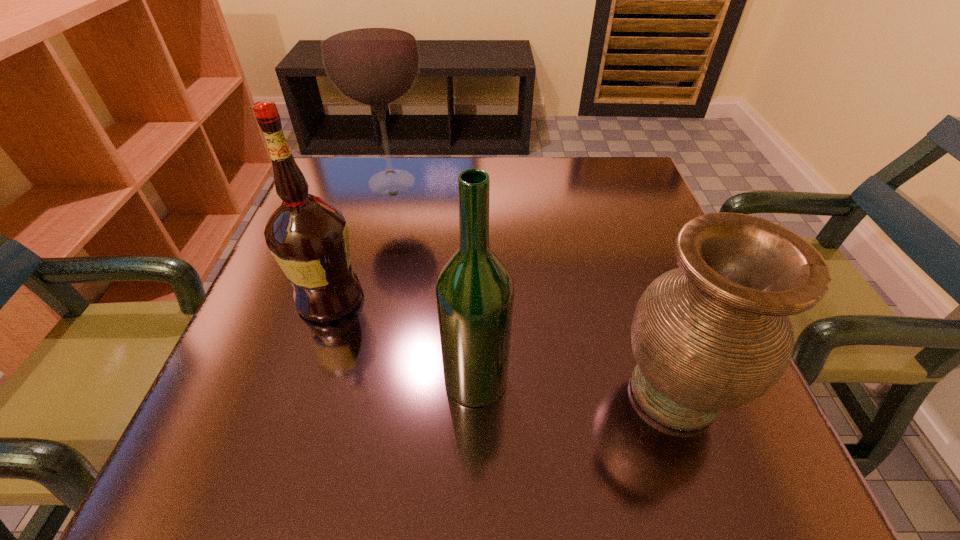
Locate an element on the screen. The image size is (960, 540). blank region between the rightmost alcohol and the farthest object is located at coordinates (434, 281).

In order to click on empty location between the rightmost alcohol and the shortest object in this screenshot , I will do pyautogui.click(x=575, y=385).

Identify which object is the third nearest to the farthest alcohol. Please provide its 2D coordinates. Your answer should be formatted as a tuple, i.e. [(x, y)], where the tuple contains the x and y coordinates of a point satisfying the conditions above.

[(714, 334)]

Identify which object is the second nearest to the rightmost alcohol. Please provide its 2D coordinates. Your answer should be formatted as a tuple, i.e. [(x, y)], where the tuple contains the x and y coordinates of a point satisfying the conditions above.

[(308, 237)]

At what (x,y) coordinates should I click in order to perform the action: click on alcohol identified as the closest to the second farthest object. Please return your answer as a coordinate pair (x, y). Looking at the image, I should click on (474, 289).

Identify which alcohol is the closest to the rightmost alcohol. Please provide its 2D coordinates. Your answer should be formatted as a tuple, i.e. [(x, y)], where the tuple contains the x and y coordinates of a point satisfying the conditions above.

[(308, 237)]

Image resolution: width=960 pixels, height=540 pixels. What are the coordinates of `vacant region that satisfies the following two spatial constraints: 1. on the label of the second farthest object; 2. on the left side of the nearest alcohol` in the screenshot? It's located at (303, 379).

You are a GUI agent. You are given a task and a screenshot of the screen. Output one action in this format:
    pyautogui.click(x=<x>, y=<y>)
    Task: Click on the free space that satisfies the following two spatial constraints: 1. on the label of the second farthest object; 2. on the left side of the rightmost object
    The width and height of the screenshot is (960, 540).
    Given the screenshot: What is the action you would take?
    pyautogui.click(x=300, y=392)

This screenshot has width=960, height=540. In order to click on free location that satisfies the following two spatial constraints: 1. on the front side of the vase; 2. on the left side of the second object from right to left in this screenshot , I will do `click(476, 392)`.

Image resolution: width=960 pixels, height=540 pixels. Find the location of `free point that satisfies the following two spatial constraints: 1. on the back side of the nearest alcohol; 2. on the label of the second nearest alcohol`. free point that satisfies the following two spatial constraints: 1. on the back side of the nearest alcohol; 2. on the label of the second nearest alcohol is located at coordinates (476, 298).